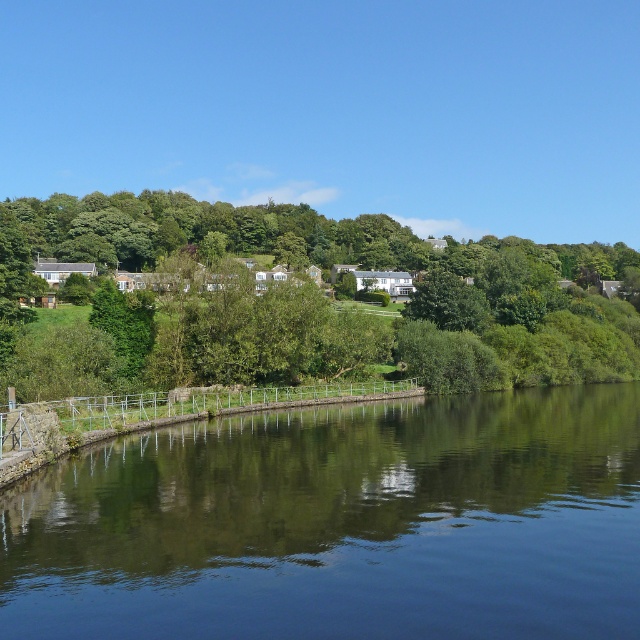
You are standing on the riverside walkway and notice the dark blue water at center and the green leafy tree at center. Which object is located closer to the ground?

The dark blue water at center is positioned under the green leafy tree at center, so it is closer to the ground than the tree.

You are standing on the stone embankment with the metal railing on the left side of the image. You want to take a photo that includes both the dark blue water at center and the green leafy tree at center. Which object should you position closer to the front of your photo to include both in the frame?

You should position the dark blue water at center closer to the front of your photo because it is in front of the green leafy tree at center, allowing both to be captured in the frame.